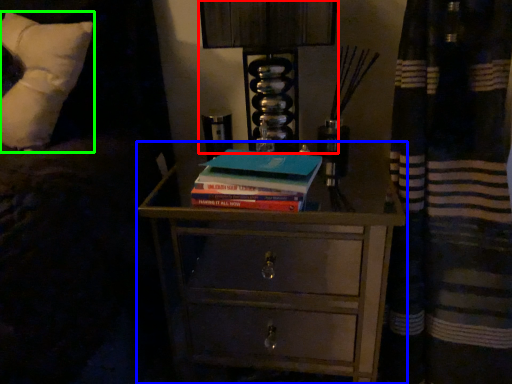
Question: Based on their relative distances, which object is nearer to bedside lamp (highlighted by a red box)? Choose from chest of drawers (highlighted by a blue box) and pillow (highlighted by a green box).

Choices:
 (A) chest of drawers
 (B) pillow

Answer: (A)